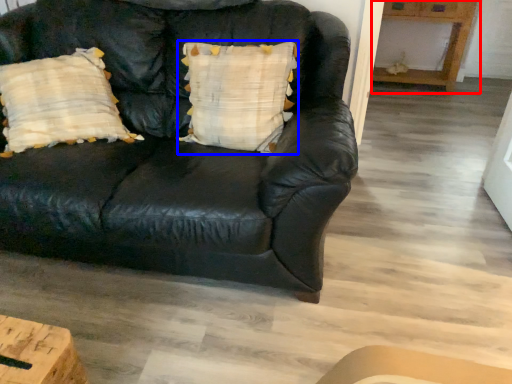
Question: Which of the following is the closest to the observer, table (highlighted by a red box) or pillow (highlighted by a blue box)?

Choices:
 (A) table
 (B) pillow

Answer: (B)